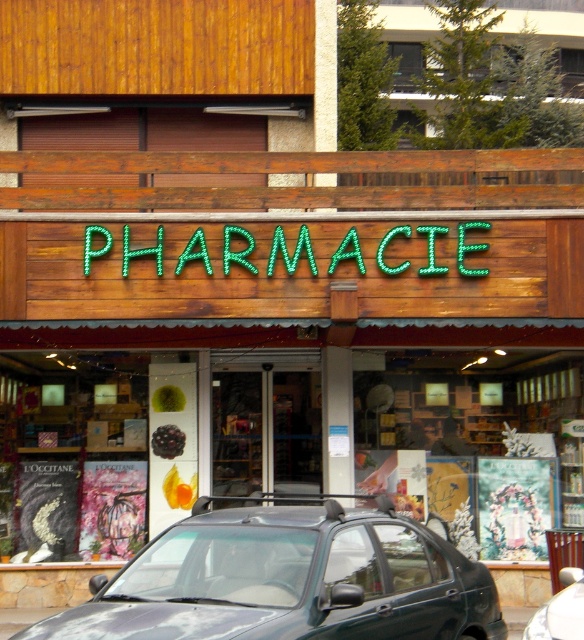
Between dark green matte car at center and metallic gray car at center, which one appears on the right side from the viewer's perspective?

metallic gray car at center

Does dark green matte car at center have a larger size compared to metallic gray car at center?

Indeed, dark green matte car at center has a larger size compared to metallic gray car at center.

Between point (140, 612) and point (571, 566), which one is positioned behind?

The point (571, 566) is behind.

Locate an element on the screen. The image size is (584, 640). dark green matte car at center is located at coordinates (288, 580).

From the picture: Can you confirm if wooden display case at center is thinner than green neon sign at center?

Correct, wooden display case at center's width is less than green neon sign at center's.

Can you confirm if wooden display case at center is shorter than green neon sign at center?

In fact, wooden display case at center may be taller than green neon sign at center.

Does point (353, 406) lie behind point (164, 230)?

Yes, point (353, 406) is farther from viewer.

Where is `wooden display case at center`? wooden display case at center is located at coordinates (300, 435).

Who is more distant from viewer, (366, 634) or (178, 272)?

Positioned behind is point (178, 272).

Based on the photo, is dark green matte car at center thinner than green neon sign at center?

Correct, dark green matte car at center's width is less than green neon sign at center's.

Is point (151, 611) behind point (326, 269)?

No.

At what (x,y) coordinates should I click in order to perform the action: click on dark green matte car at center. Please return your answer as a coordinate pair (x, y). The image size is (584, 640). Looking at the image, I should click on (288, 580).